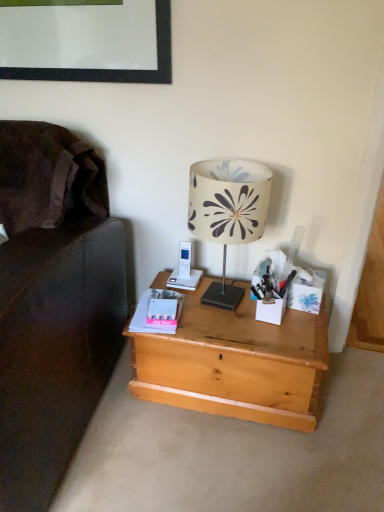
The width and height of the screenshot is (384, 512). In order to click on free spot below white fabric lampshade at center (from a real-world perspective) in this screenshot , I will do `click(230, 306)`.